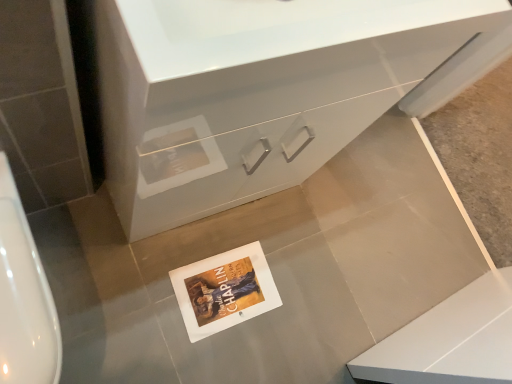
Locate an element on the screen. This screenshot has height=384, width=512. empty space that is to the right of white glossy cabinet at center is located at coordinates (298, 263).